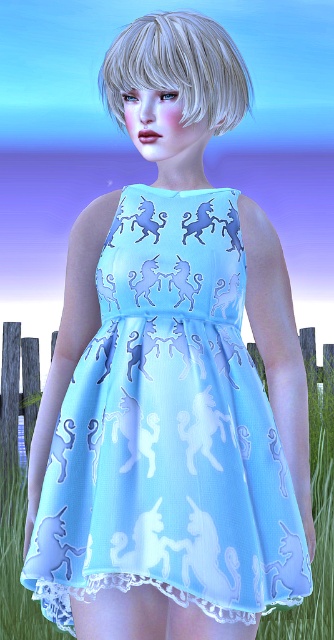
You are a photographer trying to capture the person in the scene. Since the light blue fabric dress at center and the blonde silky hair at upper center are both important elements, which one should you focus on first to ensure they are both in frame?

The light blue fabric dress at center is positioned on the left side of blonde silky hair at upper center, so you should focus on the blonde silky hair at upper center first to ensure both elements are in frame.

You are a photographer standing at a certain distance from the light blue fabric dress at center. You want to capture a portrait that requires a minimum of 6 feet of distance between you and the subject to avoid distortion. Based on the scene description, can you proceed with taking the photo without moving closer or farther away?

The light blue fabric dress at center and viewer are 5.49 feet apart from each other. Since 5.49 feet is less than the required 6 feet, you cannot proceed without adjusting your position to maintain the minimum distance.

From the picture: You are a photographer trying to capture a full body shot of the person wearing the light blue fabric dress at center. The wooden fence at lower center is in the way. Can you estimate if the dress is wider than the fence?

The light blue fabric dress at center might be wider than wooden fence at lower center, so there is a possibility that the dress extends beyond the fence. To ensure the full dress is captured, you may need to adjust your angle or position to include more space around the person.